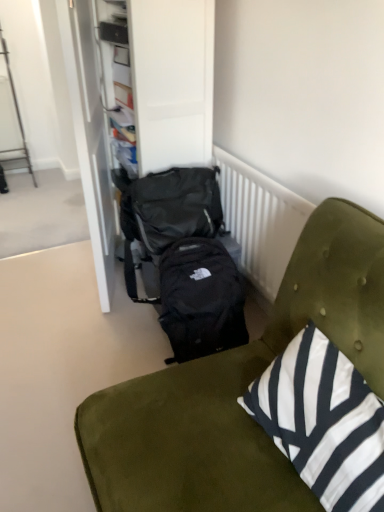
Question: In the image, is black fabric backpack at center on the left side or the right side of black fabric backpack at center, the second backpack ordered from the bottom?

Choices:
 (A) left
 (B) right

Answer: (B)

Question: Is point (160, 499) positioned closer to the camera than point (135, 226)?

Choices:
 (A) closer
 (B) farther

Answer: (A)

Question: Considering the real-world distances, which object is farthest from the white striped fabric pillow at lower right?

Choices:
 (A) black fabric backpack at center
 (B) black matte backpack at center, which appears as the first backpack when ordered from the bottom
 (C) black fabric backpack at center, positioned as the first backpack in top-to-bottom order
 (D) black fabric dresser at center
 (E) white textured radiator at center

Answer: (D)

Question: Considering the real-world distances, which object is closest to the white textured radiator at center?

Choices:
 (A) black fabric backpack at center, positioned as the first backpack in top-to-bottom order
 (B) black fabric backpack at center
 (C) black fabric dresser at center
 (D) black matte backpack at center, which is counted as the second backpack, starting from the top
 (E) white striped fabric pillow at lower right

Answer: (A)